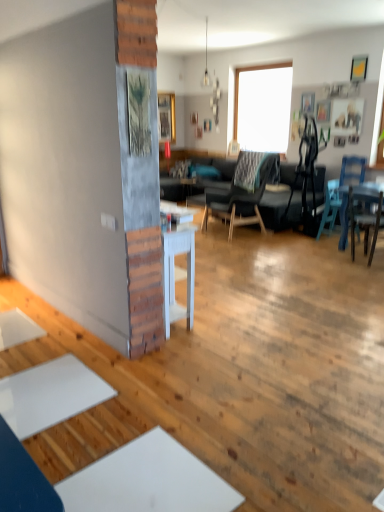
Question: Can you confirm if wooden picture frame at upper right, the fifth picture frame from the left, is thinner than wooden picture frame at upper right, the 2th picture frame from the top?

Choices:
 (A) no
 (B) yes

Answer: (B)

Question: Is wooden picture frame at upper right, the fifth picture frame from the left, taller than wooden picture frame at upper right, which is the fifth picture frame in bottom-to-top order?

Choices:
 (A) yes
 (B) no

Answer: (A)

Question: From the image's perspective, would you say wooden picture frame at upper right, placed as the fourth picture frame when sorted from back to front, is shown under wooden picture frame at upper right, which appears as the 1th picture frame when viewed from the right?

Choices:
 (A) no
 (B) yes

Answer: (B)

Question: Is wooden picture frame at upper right, placed as the fourth picture frame when sorted from back to front, behind wooden picture frame at upper right, which is counted as the second picture frame, starting from the front?

Choices:
 (A) yes
 (B) no

Answer: (A)

Question: Does wooden picture frame at upper right, placed as the fourth picture frame when sorted from back to front, have a smaller size compared to wooden picture frame at upper right, which is counted as the second picture frame, starting from the front?

Choices:
 (A) no
 (B) yes

Answer: (A)

Question: From the image's perspective, is dark gray fabric chair at center, marked as the first chair in a left-to-right arrangement, positioned above or below blue plastic chair at right, the second chair from the right?

Choices:
 (A) below
 (B) above

Answer: (B)

Question: Does point (256, 207) appear closer or farther from the camera than point (345, 167)?

Choices:
 (A) farther
 (B) closer

Answer: (A)

Question: Is dark gray fabric chair at center, marked as the first chair in a left-to-right arrangement, in front of or behind blue plastic chair at right, the second chair from the right, in the image?

Choices:
 (A) behind
 (B) front

Answer: (A)

Question: Choose the correct answer: Is dark gray fabric chair at center, which is counted as the third chair, starting from the right, inside blue plastic chair at right, the second chair from the right, or outside it?

Choices:
 (A) outside
 (B) inside

Answer: (A)

Question: From their relative heights in the image, would you say wooden picture frame at center, the 1th picture frame viewed from the top, is taller or shorter than wooden picture frame at upper right, the second picture frame positioned from the right?

Choices:
 (A) short
 (B) tall

Answer: (B)

Question: Is wooden picture frame at center, which is the 6th picture frame in bottom-to-top order, spatially inside wooden picture frame at upper right, which appears as the 2th picture frame when ordered from the bottom, or outside of it?

Choices:
 (A) outside
 (B) inside

Answer: (A)

Question: From a real-world perspective, is wooden picture frame at center, which is the 6th picture frame in bottom-to-top order, positioned above or below wooden picture frame at upper right, which ranks as the third picture frame in front-to-back order?

Choices:
 (A) above
 (B) below

Answer: (A)

Question: From the image's perspective, is wooden picture frame at center, which is the sixth picture frame in right-to-left order, positioned above or below wooden picture frame at upper right, which ranks as the third picture frame in front-to-back order?

Choices:
 (A) above
 (B) below

Answer: (A)

Question: From a real-world perspective, is wooden textured picture frame at center, which is the 6th picture frame from top to bottom, above or below blue plastic chair at right, the second chair from the right?

Choices:
 (A) below
 (B) above

Answer: (B)

Question: From the image's perspective, relative to blue plastic chair at right, the second chair from the right, is wooden textured picture frame at center, the sixth picture frame viewed from the back, above or below?

Choices:
 (A) above
 (B) below

Answer: (A)